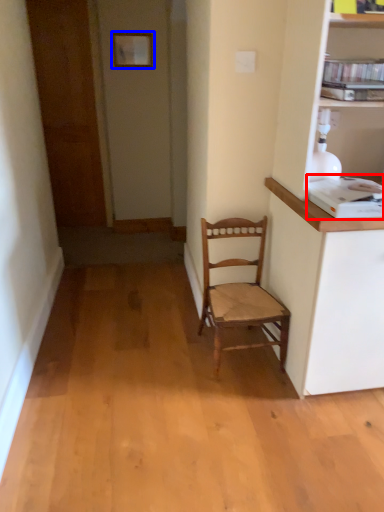
Question: Which of the following is the farthest to the observer, appliance (highlighted by a red box) or picture frame (highlighted by a blue box)?

Choices:
 (A) appliance
 (B) picture frame

Answer: (B)